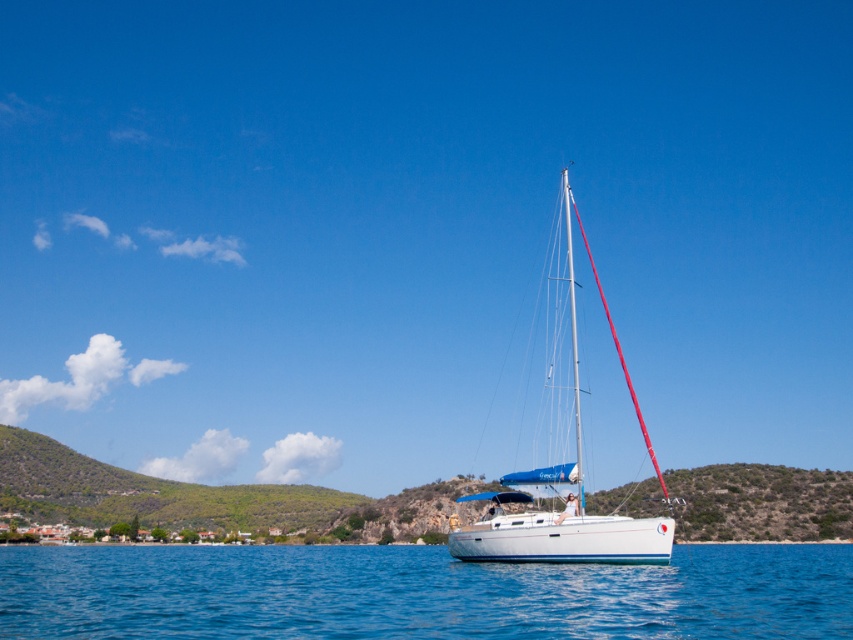
Question: Is blue water at center bigger than white glossy sailboat at center?

Choices:
 (A) yes
 (B) no

Answer: (B)

Question: Is blue water at center bigger than white glossy sailboat at center?

Choices:
 (A) yes
 (B) no

Answer: (B)

Question: Among these objects, which one is nearest to the camera?

Choices:
 (A) white glossy sailboat at center
 (B) blue water at center

Answer: (B)

Question: Does blue water at center have a larger size compared to white glossy sailboat at center?

Choices:
 (A) no
 (B) yes

Answer: (A)

Question: Among these objects, which one is nearest to the camera?

Choices:
 (A) white glossy sailboat at center
 (B) blue water at center

Answer: (B)

Question: Which object appears farthest from the camera in this image?

Choices:
 (A) blue water at center
 (B) white glossy sailboat at center

Answer: (B)